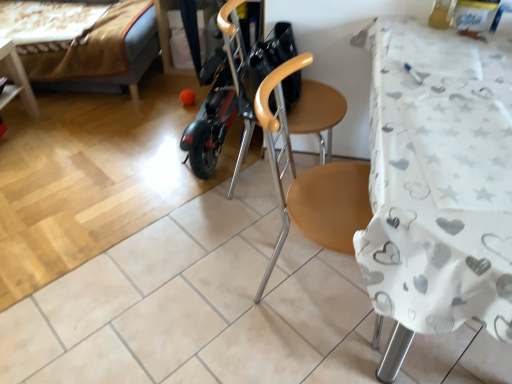
Question: Is wooden swivel chair at center behind wooden chair at center?

Choices:
 (A) yes
 (B) no

Answer: (A)

Question: From a real-world perspective, is wooden swivel chair at center over wooden chair at center?

Choices:
 (A) no
 (B) yes

Answer: (B)

Question: Is there a large distance between wooden swivel chair at center and wooden chair at center?

Choices:
 (A) yes
 (B) no

Answer: (B)

Question: Is wooden swivel chair at center facing away from wooden chair at center?

Choices:
 (A) yes
 (B) no

Answer: (B)

Question: From the image's perspective, would you say wooden swivel chair at center is shown under wooden chair at center?

Choices:
 (A) no
 (B) yes

Answer: (A)

Question: Are wooden swivel chair at center and wooden chair at center making contact?

Choices:
 (A) yes
 (B) no

Answer: (B)

Question: Considering the relative sizes of velvet brown bed at upper left and wooden swivel chair at center in the image provided, is velvet brown bed at upper left taller than wooden swivel chair at center?

Choices:
 (A) yes
 (B) no

Answer: (B)

Question: Does velvet brown bed at upper left appear on the left side of wooden swivel chair at center?

Choices:
 (A) no
 (B) yes

Answer: (B)

Question: Is velvet brown bed at upper left beside wooden swivel chair at center?

Choices:
 (A) yes
 (B) no

Answer: (B)

Question: Is velvet brown bed at upper left behind wooden swivel chair at center?

Choices:
 (A) no
 (B) yes

Answer: (B)

Question: From the image's perspective, is velvet brown bed at upper left on top of wooden swivel chair at center?

Choices:
 (A) no
 (B) yes

Answer: (B)

Question: Is velvet brown bed at upper left far away from wooden swivel chair at center?

Choices:
 (A) yes
 (B) no

Answer: (A)

Question: Is velvet brown bed at upper left bigger than wooden chair at center?

Choices:
 (A) yes
 (B) no

Answer: (A)